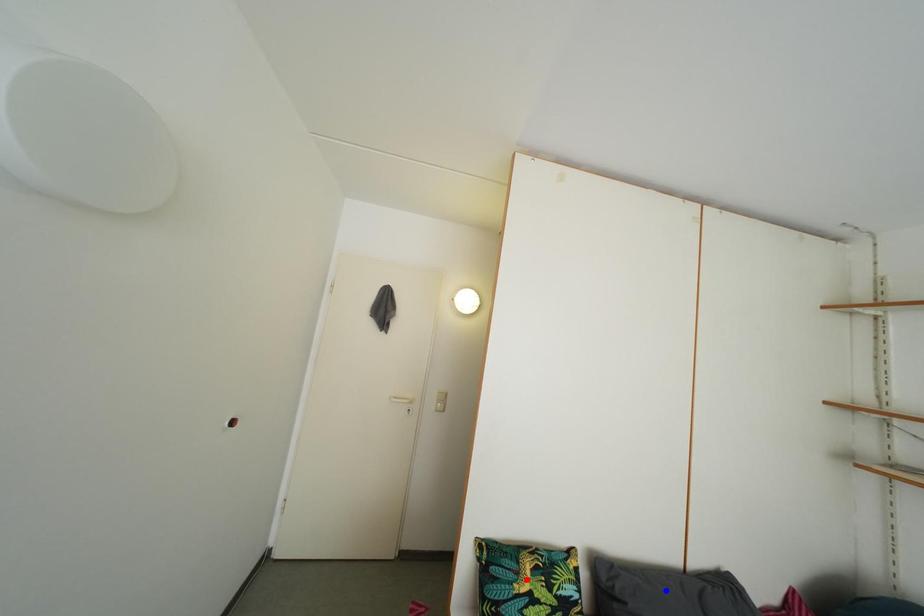
Question: In the image, two points are highlighted. Which point is nearer to the camera? Reply with the corresponding letter.

Choices:
 (A) blue point
 (B) red point

Answer: (B)